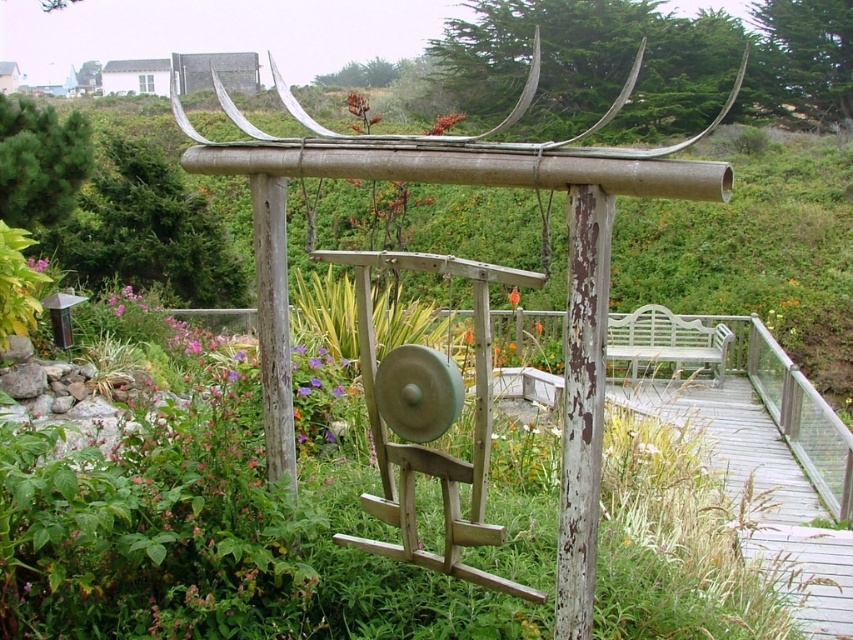
From the picture: Who is positioned more to the left, wooden gong at center or rusty wood gong at center?

Result: Positioned to the left is rusty wood gong at center.

Is wooden gong at center wider than rusty wood gong at center?

No, wooden gong at center is not wider than rusty wood gong at center.

Identify the location of wooden gong at center. This screenshot has width=853, height=640. (151, 525).

Is point (235, 150) positioned behind point (39, 260)?

No.

Consider the image. Who is more forward, (396,140) or (32,264)?

Point (396,140) is in front.

Find the location of a particular element. The image size is (853, 640). rusty wood gong at center is located at coordinates (476, 184).

Based on the photo, does pink matte flower at upper left appear under purple matte flower at center?

No.

At what (x,y) coordinates should I click in order to perform the action: click on pink matte flower at upper left. Please return your answer as a coordinate pair (x, y). The image size is (853, 640). Looking at the image, I should click on (38, 262).